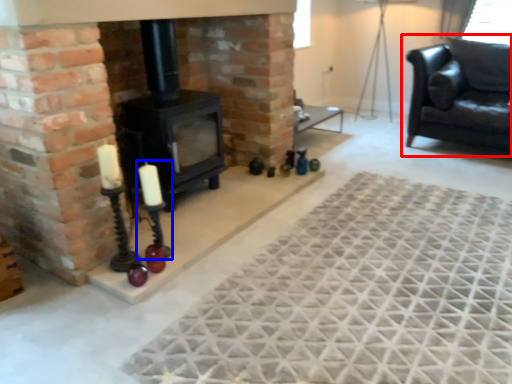
Question: Which of the following is the farthest to the observer, studio couch (highlighted by a red box) or candle holder (highlighted by a blue box)?

Choices:
 (A) studio couch
 (B) candle holder

Answer: (A)